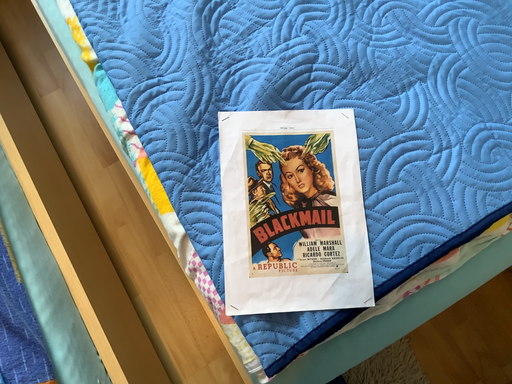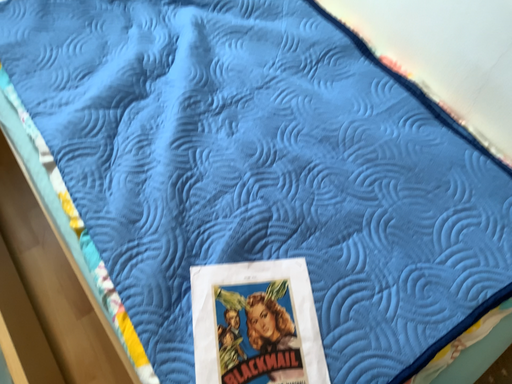
Question: How did the camera likely rotate when shooting the video?

Choices:
 (A) rotated downward
 (B) rotated upward

Answer: (B)